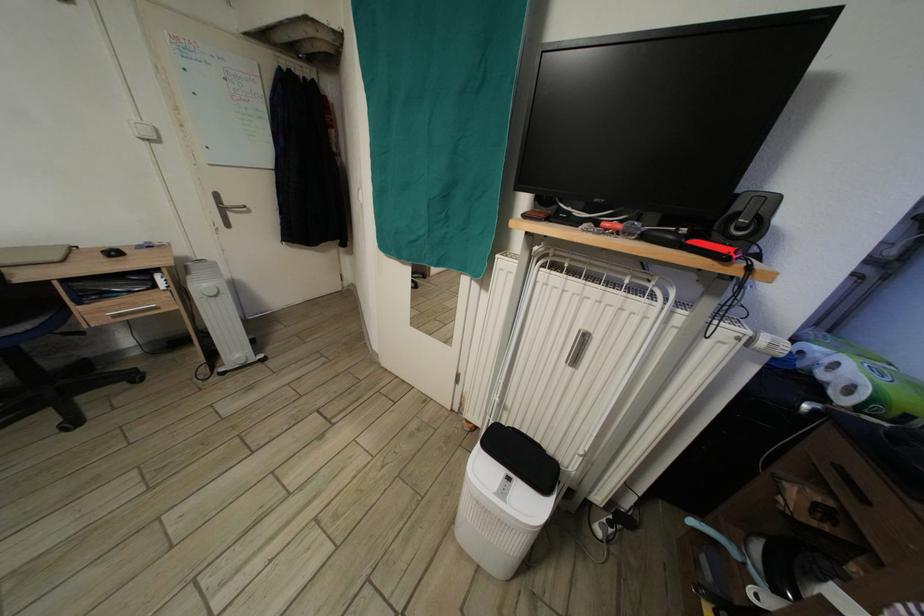
You are a GUI agent. You are given a task and a screenshot of the screen. Output one action in this format:
    pyautogui.click(x=<x>, y=<y>)
    Task: Click on the heater control dial
    
    Given the screenshot: What is the action you would take?
    pyautogui.click(x=747, y=219)